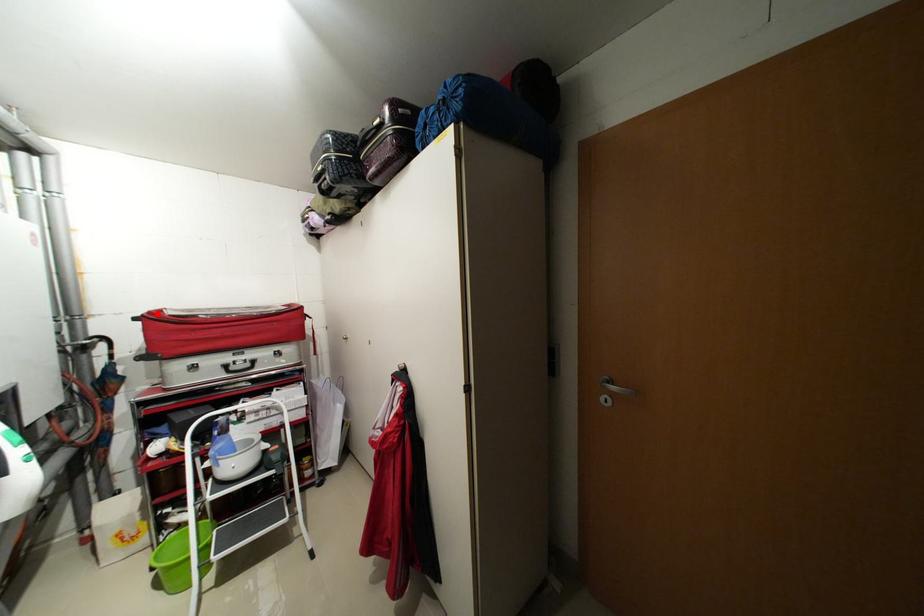
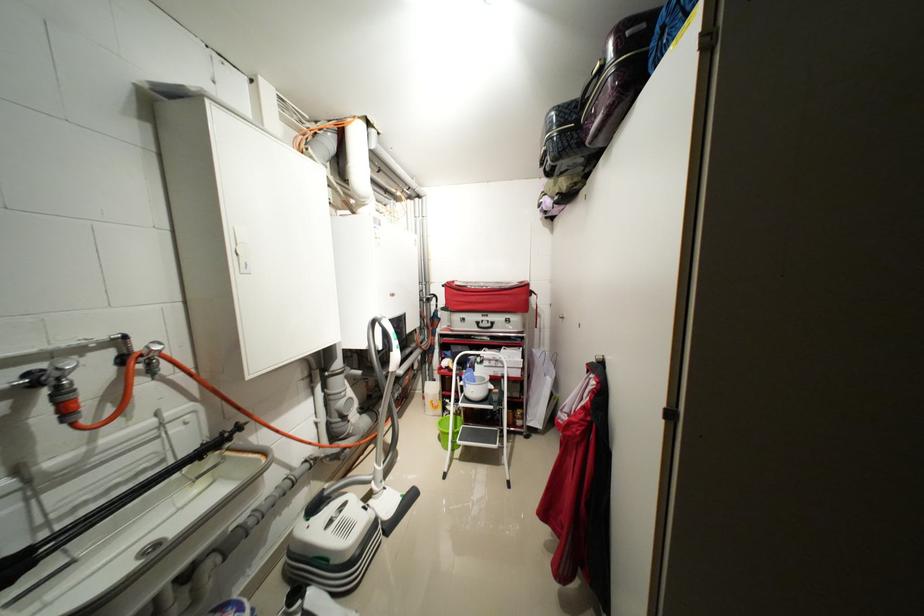
In the second image, find the point that corresponds to the highlighted location in the first image.

(455, 284)